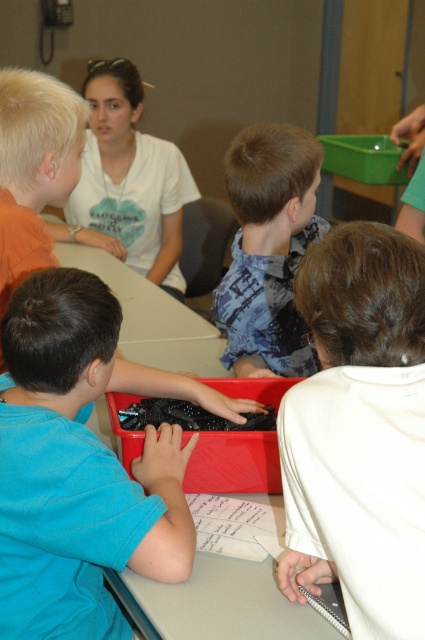
Question: Is blue matte shirt at center positioned in front of blue printed shirt at center?

Choices:
 (A) no
 (B) yes

Answer: (B)

Question: Where is blue matte shirt at center located in relation to blue printed shirt at center in the image?

Choices:
 (A) left
 (B) right

Answer: (A)

Question: Can you confirm if blue matte shirt at center is positioned to the right of white matte notebook at lower right?

Choices:
 (A) yes
 (B) no

Answer: (B)

Question: Which of these objects is positioned closest to the white matte shirt at upper center?

Choices:
 (A) white plastic table at center
 (B) blue matte shirt at center
 (C) white matte notebook at lower right
 (D) blue printed shirt at center

Answer: (A)

Question: Which object appears farthest from the camera in this image?

Choices:
 (A) blue matte shirt at center
 (B) white plastic table at center

Answer: (B)

Question: Based on their relative distances, which object is nearer to the blue matte shirt at center?

Choices:
 (A) white matte shirt at upper center
 (B) white matte notebook at lower right
 (C) white plastic table at center

Answer: (B)